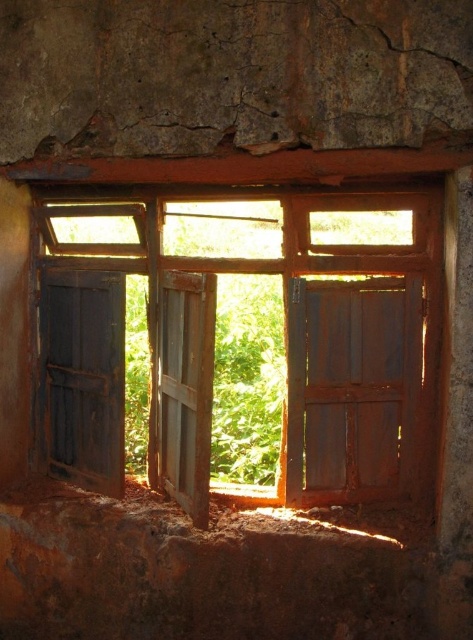
Question: From the image, what is the correct spatial relationship of rusty wood window at center in relation to dark wood shutter at left?

Choices:
 (A) right
 (B) left

Answer: (A)

Question: Among these points, which one is farthest from the camera?

Choices:
 (A) (57, 474)
 (B) (183, 460)
 (C) (237, 362)

Answer: (C)

Question: Which of these objects is positioned closest to the dark wood shutter at left?

Choices:
 (A) rusty wood window at center
 (B) weathered wood shutter at center

Answer: (A)

Question: Among these points, which one is nearest to the camera?

Choices:
 (A) (62, 264)
 (B) (42, 376)

Answer: (A)

Question: Does rusty wood window at center have a larger size compared to dark wood shutter at left?

Choices:
 (A) yes
 (B) no

Answer: (A)

Question: Does rusty wood window at center appear under weathered wood shutter at center?

Choices:
 (A) no
 (B) yes

Answer: (A)